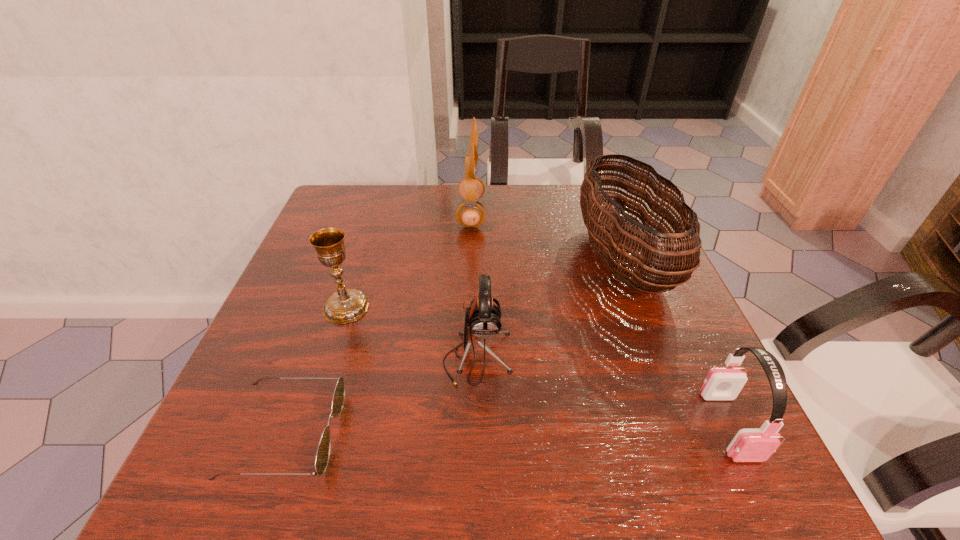
Select which object appears as the fifth closest to the sunglasses. Please provide its 2D coordinates. Your answer should be formatted as a tuple, i.e. [(x, y)], where the tuple contains the x and y coordinates of a point satisfying the conditions above.

[(749, 445)]

Choose which object is the second nearest neighbor to the sunglasses. Please provide its 2D coordinates. Your answer should be formatted as a tuple, i.e. [(x, y)], where the tuple contains the x and y coordinates of a point satisfying the conditions above.

[(482, 319)]

In order to click on the closest earphone to the rightmost earphone in this screenshot , I will do `click(482, 319)`.

Select which earphone is the second closest to the second farthest earphone. Please provide its 2D coordinates. Your answer should be formatted as a tuple, i.e. [(x, y)], where the tuple contains the x and y coordinates of a point satisfying the conditions above.

[(469, 214)]

You are a GUI agent. You are given a task and a screenshot of the screen. Output one action in this format:
    pyautogui.click(x=<x>, y=<y>)
    Task: Click on the vacant space that satisfies the following two spatial constraints: 1. on the outer surface of the nearest earphone; 2. on the front-facing side of the shortest object
    The image size is (960, 540).
    Given the screenshot: What is the action you would take?
    pyautogui.click(x=733, y=434)

Where is `free location that satisfies the following two spatial constraints: 1. on the front-facing side of the tallest earphone; 2. on the left side of the fourth farthest object`? The image size is (960, 540). free location that satisfies the following two spatial constraints: 1. on the front-facing side of the tallest earphone; 2. on the left side of the fourth farthest object is located at coordinates (468, 358).

Identify the location of vacant region that satisfies the following two spatial constraints: 1. on the back side of the basket; 2. on the right side of the chalice. (361, 259).

Where is `free spot that satisfies the following two spatial constraints: 1. on the back side of the fourth farthest object; 2. on the left side of the basket`? The image size is (960, 540). free spot that satisfies the following two spatial constraints: 1. on the back side of the fourth farthest object; 2. on the left side of the basket is located at coordinates (478, 259).

I want to click on free location that satisfies the following two spatial constraints: 1. on the outer surface of the rightmost earphone; 2. on the front-facing side of the shortest object, so point(733,434).